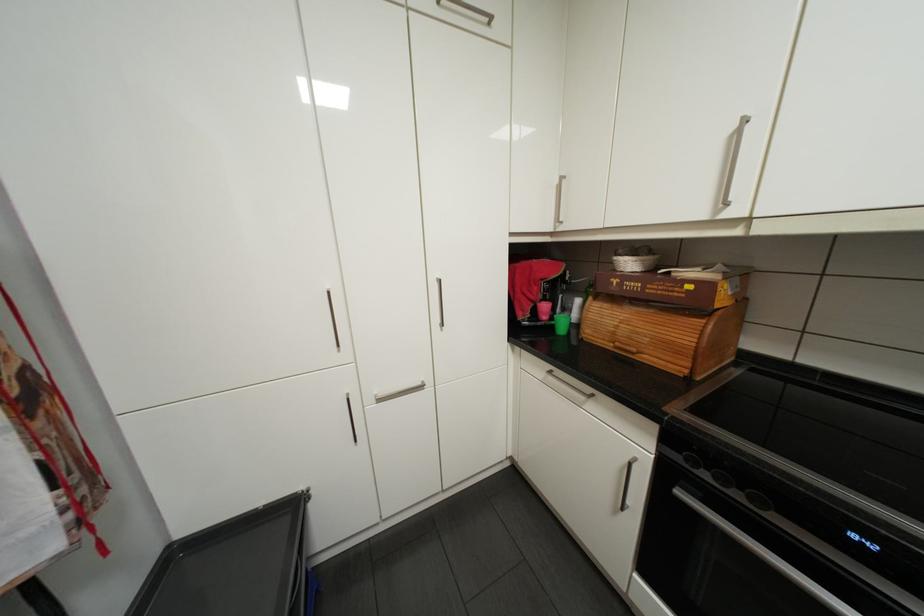
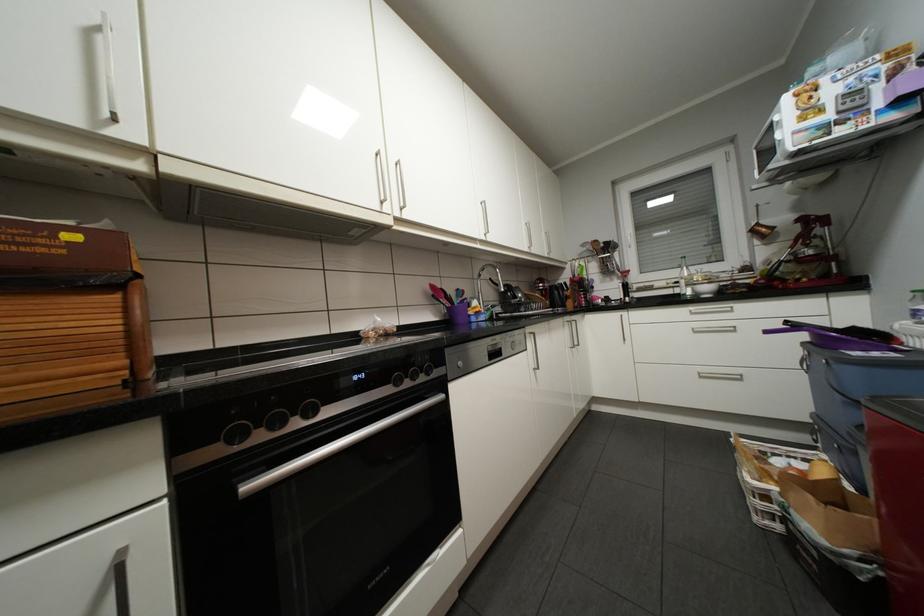
Locate, in the second image, the point that corresponds to (x=687, y=492) in the first image.

(254, 485)